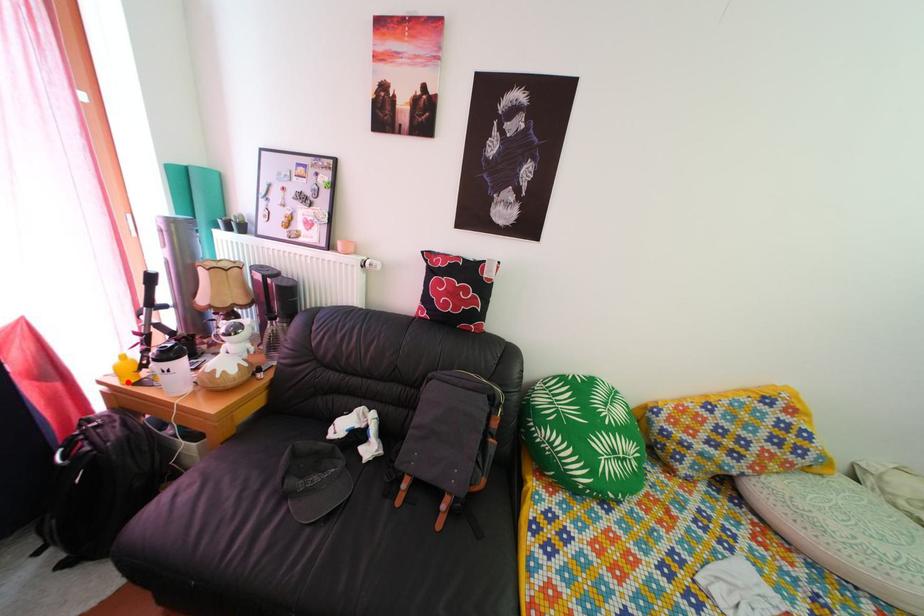
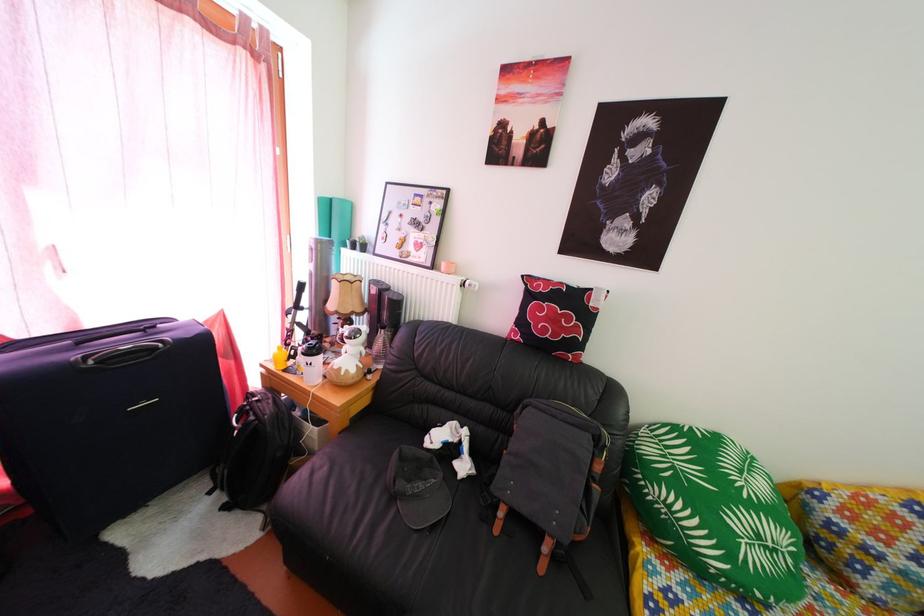
Question: I am providing you with two images of the same scene from different viewpoints. In image1, a red point is highlighted. Considering the same 3D point in image2, which of the following is correct?

Choices:
 (A) It is closer
 (B) It is farther

Answer: (B)